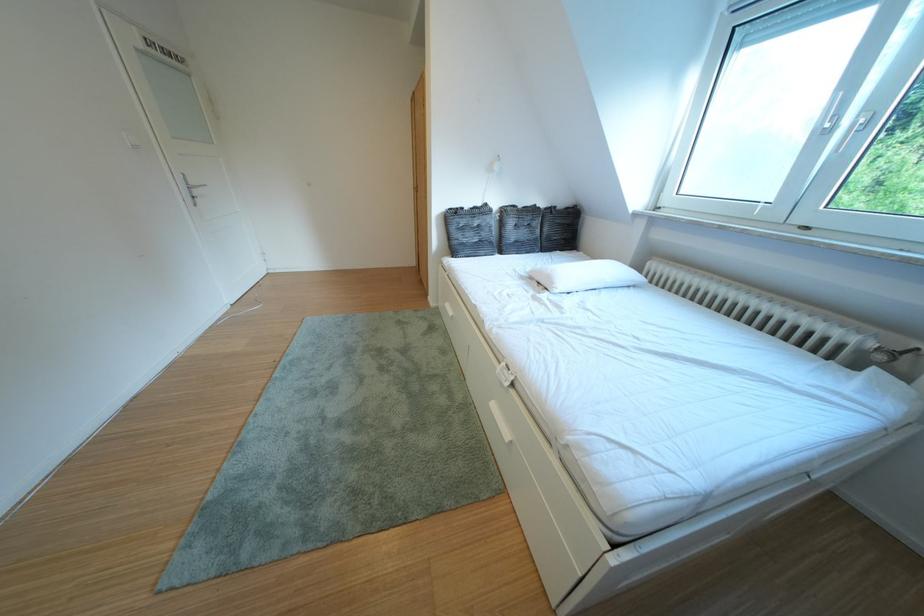
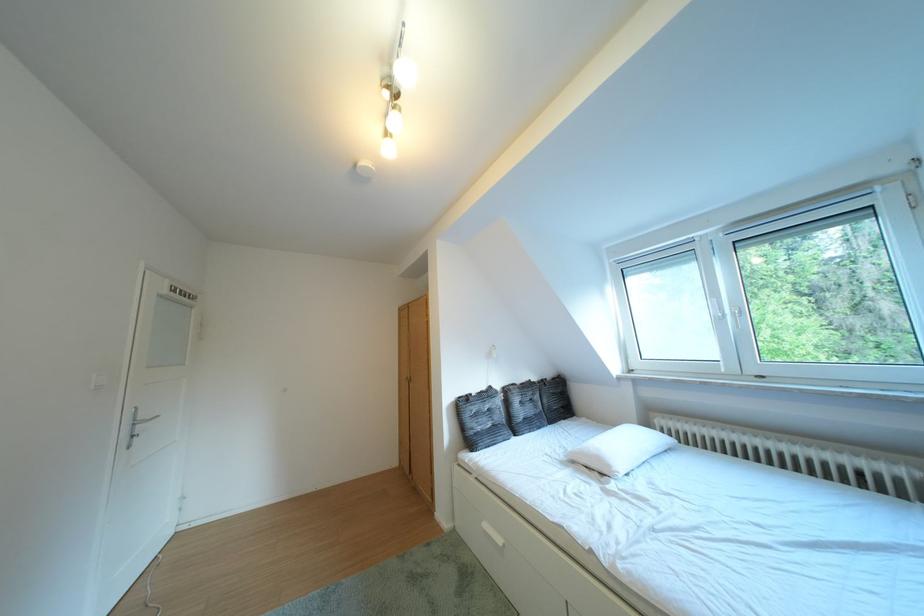
Where in the second image is the point corresponding to (565,288) from the first image?

(623, 471)